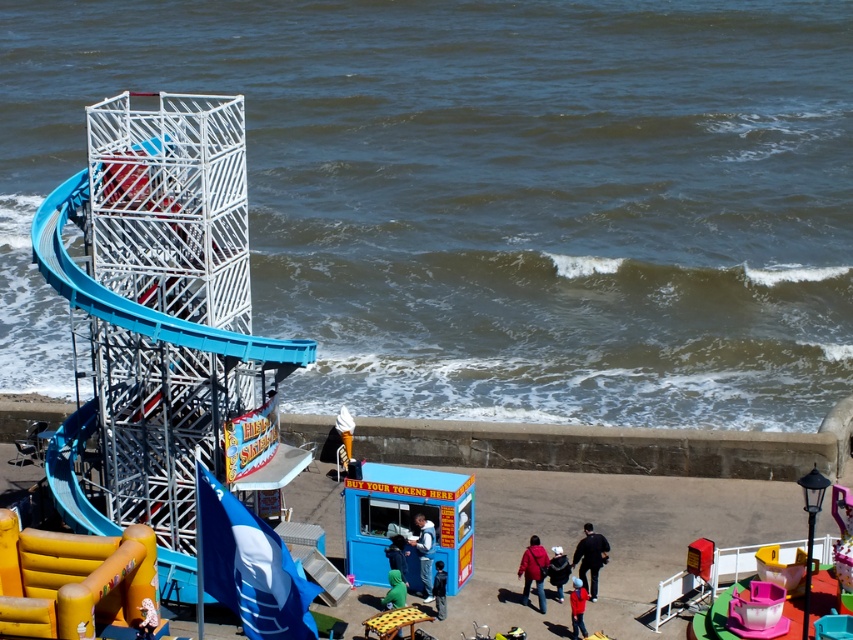
Is red cotton shirt at lower center to the right of dark blue jacket at lower center from the viewer's perspective?

Indeed, red cotton shirt at lower center is positioned on the right side of dark blue jacket at lower center.

Measure the distance between point (582, 624) and camera.

137.26 feet

Is point (573, 593) farther from viewer compared to point (440, 570)?

No.

The height and width of the screenshot is (640, 853). I want to click on red cotton shirt at lower center, so click(x=577, y=605).

Can you confirm if dark blue jacket at center is bigger than dark blue jacket at lower center?

Correct, dark blue jacket at center is larger in size than dark blue jacket at lower center.

Who is taller, dark blue jacket at center or dark blue jacket at lower center?

Standing taller between the two is dark blue jacket at center.

Which is in front, point (567, 566) or point (436, 602)?

Point (436, 602) is in front.

The height and width of the screenshot is (640, 853). I want to click on dark blue jacket at center, so click(558, 570).

Looking at this image, between red matte jacket at center and dark blue jacket at lower center, which one appears on the right side from the viewer's perspective?

red matte jacket at center

Is red matte jacket at center further to the viewer compared to dark blue jacket at lower center?

Yes, red matte jacket at center is further from the viewer.

The height and width of the screenshot is (640, 853). Describe the element at coordinates (532, 570) in the screenshot. I see `red matte jacket at center` at that location.

Where is `red matte jacket at center`? red matte jacket at center is located at coordinates (532, 570).